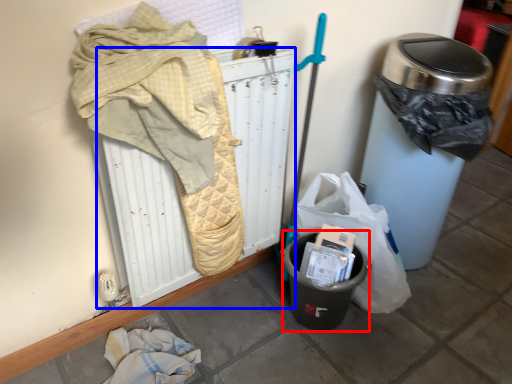
Question: Which point is closer to the camera, recycling bin (highlighted by a red box) or radiator (highlighted by a blue box)?

Choices:
 (A) recycling bin
 (B) radiator

Answer: (B)